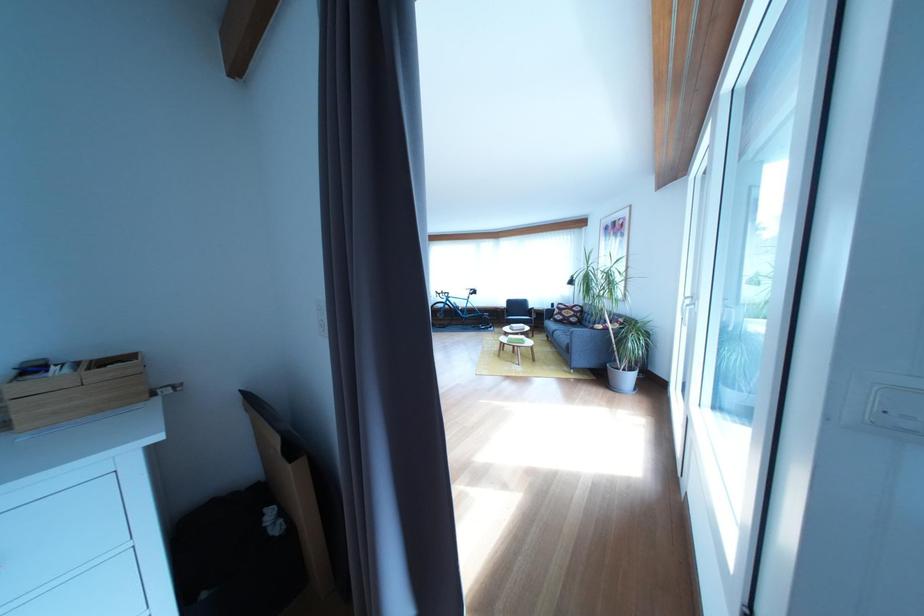
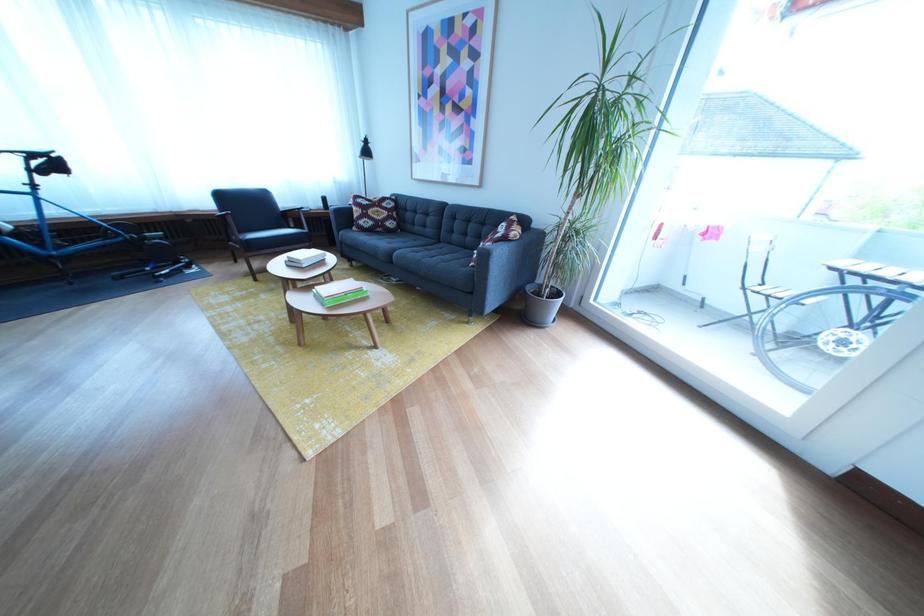
Find the pixel in the second image that matches (x=487, y=298) in the first image.

(64, 169)